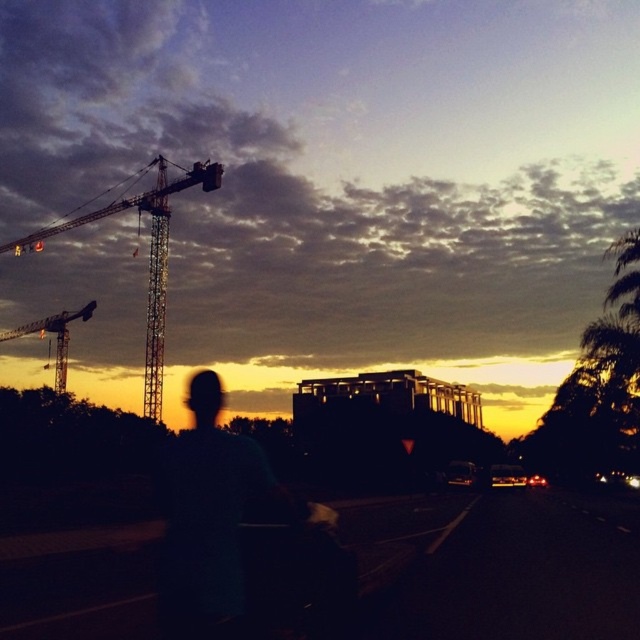
Can you confirm if matte black construction crane at upper left is positioned below metallic construction crane at upper left?

No.

Find the location of a particular element. This screenshot has height=640, width=640. matte black construction crane at upper left is located at coordinates (346, 177).

Between matte black construction crane at upper left and metallic silver crane at left, which one appears on the left side from the viewer's perspective?

From the viewer's perspective, metallic silver crane at left appears more on the left side.

Does matte black construction crane at upper left appear on the left side of metallic silver crane at left?

No, matte black construction crane at upper left is not to the left of metallic silver crane at left.

Describe the element at coordinates (346, 177) in the screenshot. I see `matte black construction crane at upper left` at that location.

Image resolution: width=640 pixels, height=640 pixels. I want to click on matte black construction crane at upper left, so click(x=346, y=177).

Can you confirm if metallic silver crane at left is thinner than metallic construction crane at upper left?

No.

Locate an element on the screen. metallic silver crane at left is located at coordinates tap(148, 257).

This screenshot has width=640, height=640. I want to click on metallic silver crane at left, so click(148, 257).